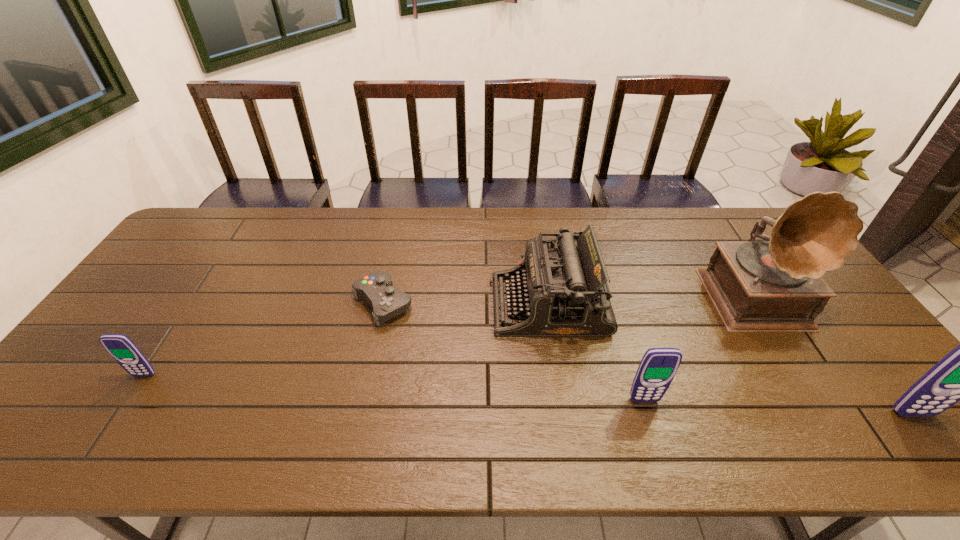
To make them evenly spaced by inserting another cellular_telephone among them, please locate a free space for this new cellular_telephone. Please provide its 2D coordinates. Your answer should be formatted as a tuple, i.e. [(x, y)], where the tuple contains the x and y coordinates of a point satisfying the conditions above.

[(388, 387)]